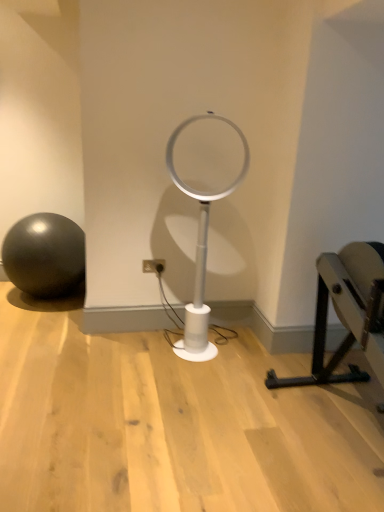
At what (x,y) coordinates should I click in order to perform the action: click on vacant area situated below black metal bench at right (from a real-world perspective). Please return your answer as a coordinate pair (x, y). The image size is (384, 512). Looking at the image, I should click on (348, 420).